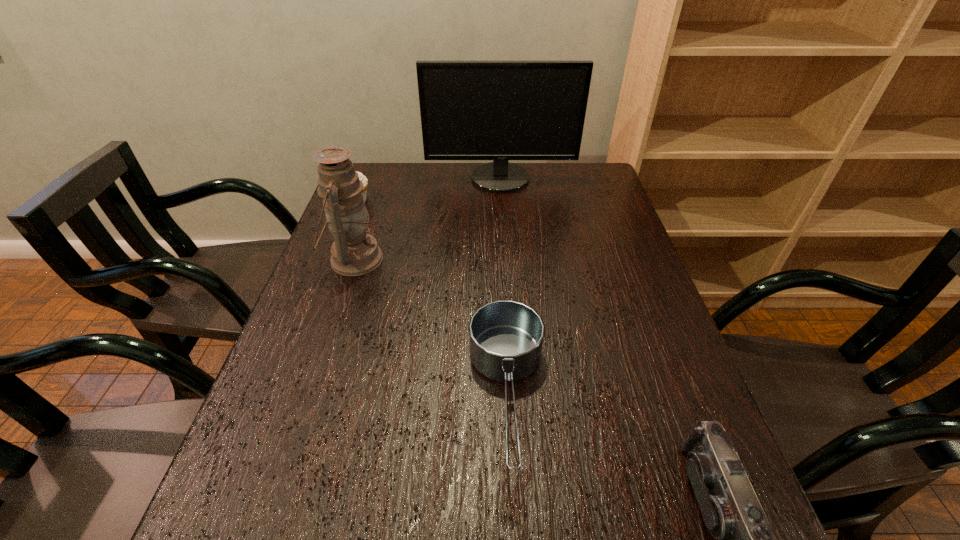
Where is `the tallest object`? The image size is (960, 540). the tallest object is located at coordinates (470, 110).

In order to click on the second tallest object in this screenshot , I will do `click(354, 252)`.

The width and height of the screenshot is (960, 540). In order to click on oil lamp in this screenshot , I will do `click(354, 252)`.

Identify the location of muffin. (363, 178).

Where is `saucepan`? Image resolution: width=960 pixels, height=540 pixels. saucepan is located at coordinates (505, 337).

The image size is (960, 540). I want to click on free location located 0.190m on the screen side of the monitor, so click(x=504, y=228).

What are the coordinates of `vacant space situated on the back of the third nearest object` in the screenshot? It's located at (384, 169).

Where is `free space located on the front of the muffin`? This screenshot has width=960, height=540. free space located on the front of the muffin is located at coordinates (326, 287).

The image size is (960, 540). I want to click on vacant space situated 0.050m with the handle extending from one side of the saucepan, so click(514, 520).

This screenshot has width=960, height=540. Identify the location of monitor that is positioned at the far edge. (470, 110).